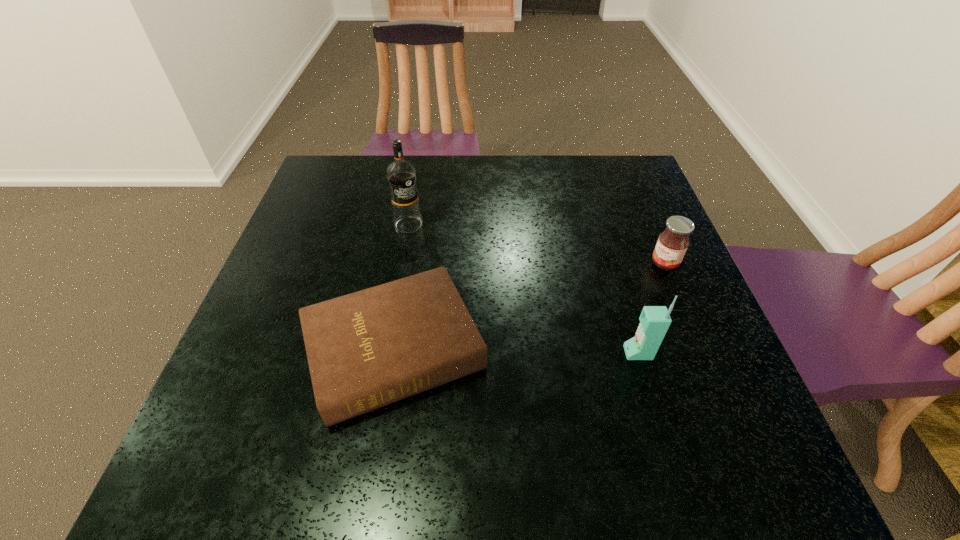
Identify the location of vacant space located on the keypad of the second tallest object. The height and width of the screenshot is (540, 960). (534, 353).

The width and height of the screenshot is (960, 540). Find the location of `free space located on the label side of the third tallest object`. free space located on the label side of the third tallest object is located at coordinates (549, 346).

At what (x,y) coordinates should I click in order to perform the action: click on vacant area situated on the label side of the third tallest object. Please return your answer as a coordinate pair (x, y). Looking at the image, I should click on (545, 349).

Where is `free region located 0.400m on the label side of the third tallest object`? The width and height of the screenshot is (960, 540). free region located 0.400m on the label side of the third tallest object is located at coordinates (531, 360).

I want to click on vacant area located on the label of the tallest object, so (444, 274).

The image size is (960, 540). Identify the location of free space located on the label of the tallest object. (422, 245).

You are a GUI agent. You are given a task and a screenshot of the screen. Output one action in this format:
    pyautogui.click(x=<x>, y=<y>)
    Task: Click on the vacant space located on the label of the tallest object
    This screenshot has height=540, width=960.
    Given the screenshot: What is the action you would take?
    pyautogui.click(x=481, y=325)

The height and width of the screenshot is (540, 960). What are the coordinates of `object positioned at the near edge` in the screenshot? It's located at (365, 350).

Where is `object that is at the left edge`? This screenshot has width=960, height=540. object that is at the left edge is located at coordinates (365, 350).

In order to click on cellular telephone present at the right edge in this screenshot , I will do `click(654, 320)`.